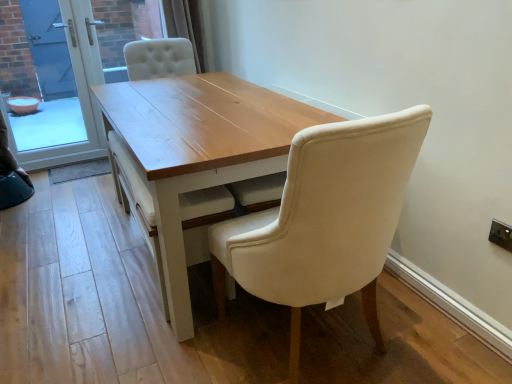
Question: From the image's perspective, would you say blue glass screen door at left, which is the 2th screen door from right to left, is shown under transparent glass screen door at upper left, arranged as the second screen door when viewed from the left?

Choices:
 (A) no
 (B) yes

Answer: (B)

Question: Considering the relative sizes of blue glass screen door at left, arranged as the first screen door when viewed from the left, and transparent glass screen door at upper left, arranged as the second screen door when viewed from the left, in the image provided, is blue glass screen door at left, arranged as the first screen door when viewed from the left, taller than transparent glass screen door at upper left, arranged as the second screen door when viewed from the left,?

Choices:
 (A) no
 (B) yes

Answer: (A)

Question: From a real-world perspective, is blue glass screen door at left, arranged as the first screen door when viewed from the left, on top of transparent glass screen door at upper left, arranged as the second screen door when viewed from the left?

Choices:
 (A) yes
 (B) no

Answer: (A)

Question: Does blue glass screen door at left, which is the 2th screen door from right to left, come behind transparent glass screen door at upper left, which is the first screen door from right to left?

Choices:
 (A) no
 (B) yes

Answer: (A)

Question: Is blue glass screen door at left, which is the 2th screen door from right to left, shorter than transparent glass screen door at upper left, arranged as the second screen door when viewed from the left?

Choices:
 (A) no
 (B) yes

Answer: (B)

Question: Is blue glass screen door at left, arranged as the first screen door when viewed from the left, turned away from transparent glass screen door at upper left, arranged as the second screen door when viewed from the left?

Choices:
 (A) yes
 (B) no

Answer: (A)

Question: Is white plastic electric outlet at upper right smaller than blue glass screen door at left, which is the 2th screen door from right to left?

Choices:
 (A) no
 (B) yes

Answer: (B)

Question: Is the depth of white plastic electric outlet at upper right less than that of blue glass screen door at left, which is the 2th screen door from right to left?

Choices:
 (A) yes
 (B) no

Answer: (A)

Question: Is blue glass screen door at left, arranged as the first screen door when viewed from the left, at the back of white plastic electric outlet at upper right?

Choices:
 (A) yes
 (B) no

Answer: (B)

Question: Is white plastic electric outlet at upper right in contact with blue glass screen door at left, which is the 2th screen door from right to left?

Choices:
 (A) yes
 (B) no

Answer: (B)

Question: Considering the relative sizes of white plastic electric outlet at upper right and blue glass screen door at left, arranged as the first screen door when viewed from the left, in the image provided, is white plastic electric outlet at upper right wider than blue glass screen door at left, arranged as the first screen door when viewed from the left,?

Choices:
 (A) yes
 (B) no

Answer: (B)

Question: Can you confirm if white plastic electric outlet at upper right is thinner than blue glass screen door at left, which is the 2th screen door from right to left?

Choices:
 (A) no
 (B) yes

Answer: (B)

Question: From the image's perspective, is blue glass screen door at left, which is the 2th screen door from right to left, over light wood table at center?

Choices:
 (A) no
 (B) yes

Answer: (B)